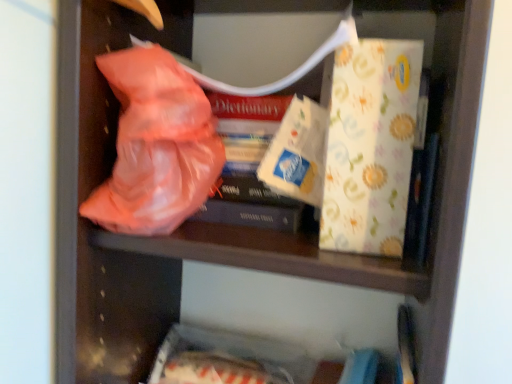
This screenshot has height=384, width=512. What do you see at coordinates (156, 146) in the screenshot?
I see `floral paper at upper center` at bounding box center [156, 146].

Measure the distance between floral paper at upper center and camera.

floral paper at upper center and camera are 17.62 inches apart from each other.

Identify the location of floral paper at upper center. (156, 146).

The width and height of the screenshot is (512, 384). In order to click on floral paper at upper center in this screenshot , I will do `click(156, 146)`.